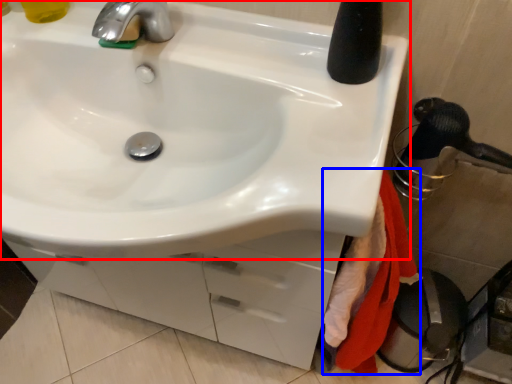
Question: Which point is closer to the camera, sink (highlighted by a red box) or bath towel (highlighted by a blue box)?

Choices:
 (A) sink
 (B) bath towel

Answer: (A)